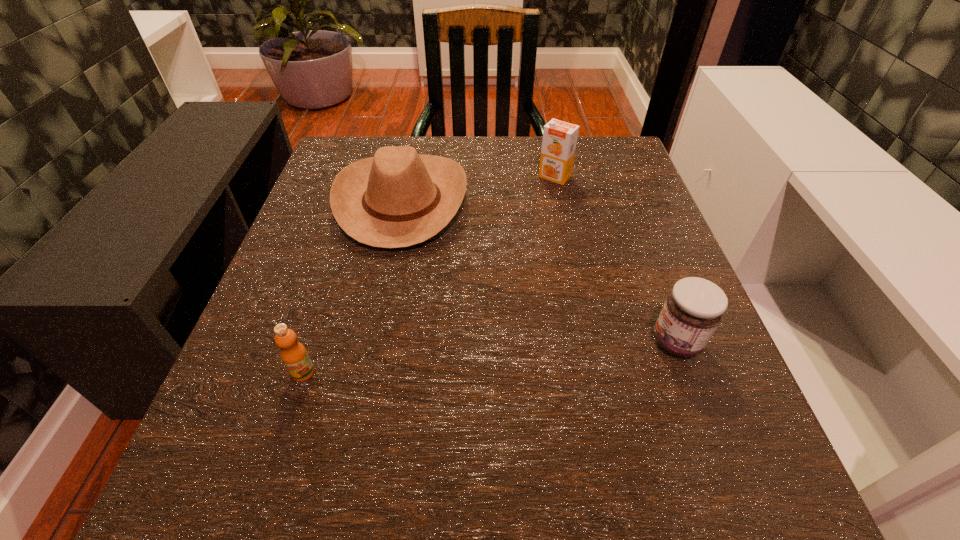
Image resolution: width=960 pixels, height=540 pixels. What are the coordinates of `vacant area at the far edge of the desktop` in the screenshot? It's located at click(477, 189).

Identify the location of free location at the near edge of the desktop. 507,503.

Find the location of a particular element. Image resolution: width=960 pixels, height=540 pixels. vacant area at the left edge of the desktop is located at coordinates click(x=248, y=438).

Find the location of `vacant area at the right edge of the desktop`. vacant area at the right edge of the desktop is located at coordinates (701, 366).

Where is `vacant area at the near left corner`? Image resolution: width=960 pixels, height=540 pixels. vacant area at the near left corner is located at coordinates (312, 456).

Identify the location of free space at the far right corner. This screenshot has height=540, width=960. (618, 174).

Locate an element on the screen. This screenshot has height=540, width=960. free space between the farther orange juice and the shorter orange juice is located at coordinates (429, 274).

This screenshot has height=540, width=960. Find the location of `free area in between the rightmost object and the cowboy hat`. free area in between the rightmost object and the cowboy hat is located at coordinates (540, 272).

Where is `free space between the taller orange juice and the shorter orange juice`? The width and height of the screenshot is (960, 540). free space between the taller orange juice and the shorter orange juice is located at coordinates (429, 274).

Identify the location of empty space between the farther orange juice and the nearer orange juice. The image size is (960, 540). (429, 274).